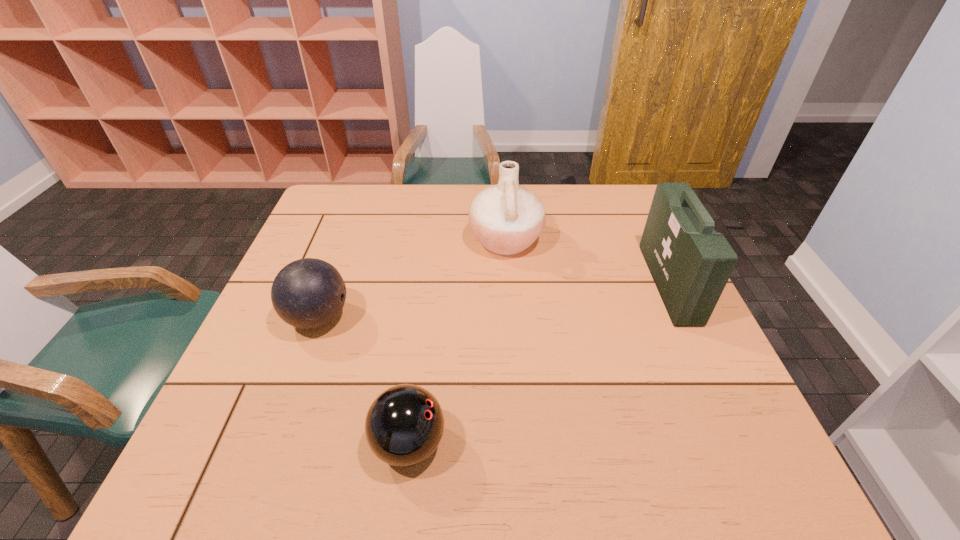
The height and width of the screenshot is (540, 960). Identify the location of the second object from right to left. (506, 218).

Identify the location of the first-aid kit. (690, 263).

Where is `the left bowling ball`? The image size is (960, 540). the left bowling ball is located at coordinates (308, 293).

Locate an element on the screen. the farther bowling ball is located at coordinates (308, 293).

This screenshot has width=960, height=540. Identify the location of the nearer bowling ball. (404, 425).

Find the location of a particular element. The image size is (960, 540). the shortest object is located at coordinates (404, 425).

This screenshot has width=960, height=540. Find the location of `vacant space located 0.100m to pour from the handle of the pottery`. vacant space located 0.100m to pour from the handle of the pottery is located at coordinates (434, 240).

Locate an element on the screen. free space located 0.340m to pour from the handle of the pottery is located at coordinates (350, 240).

Find the location of a particular element. Image resolution: width=960 pixels, height=540 pixels. free spot located to pour from the handle of the pottery is located at coordinates (448, 240).

Where is `blank space located on the front-facing side of the first-aid kit`? The width and height of the screenshot is (960, 540). blank space located on the front-facing side of the first-aid kit is located at coordinates (538, 283).